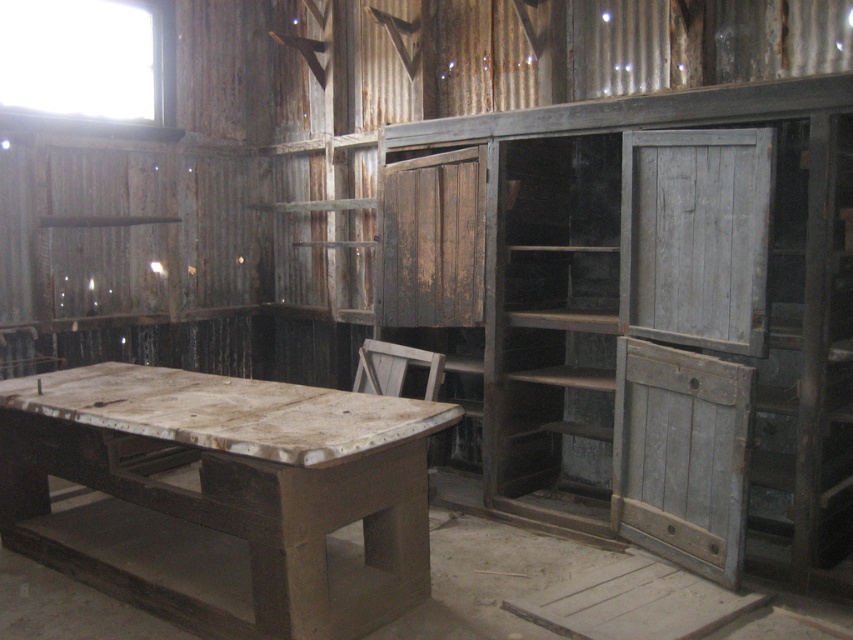
You are an interior designer assessing the space. You need to place a tall floor lamp between the weathered gray wood at center and the rusty wood cabinet at center. Which object should the lamp be placed closer to, based on their heights?

The weathered gray wood at center is much taller than the rusty wood cabinet at center, so the lamp should be placed closer to the weathered gray wood at center to maintain visual balance.